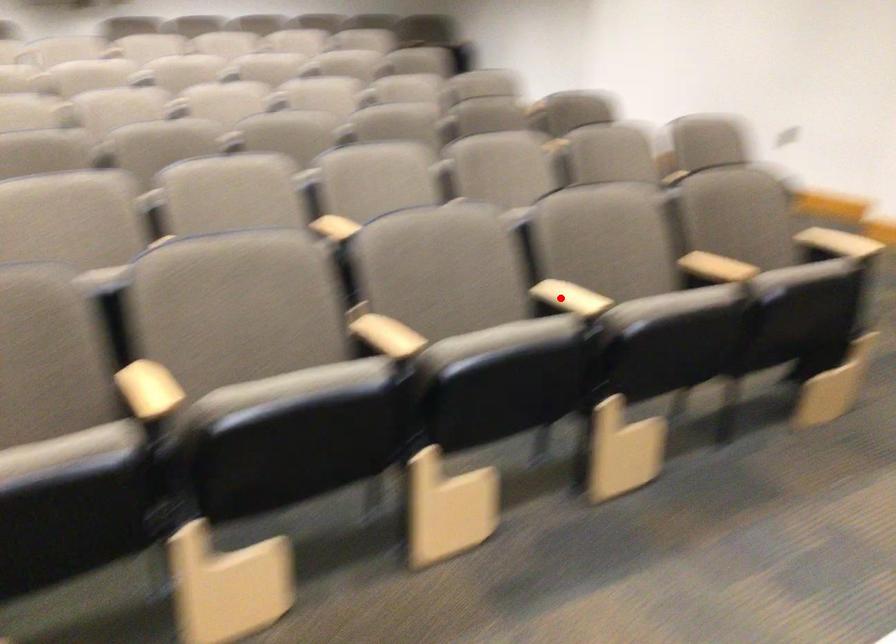
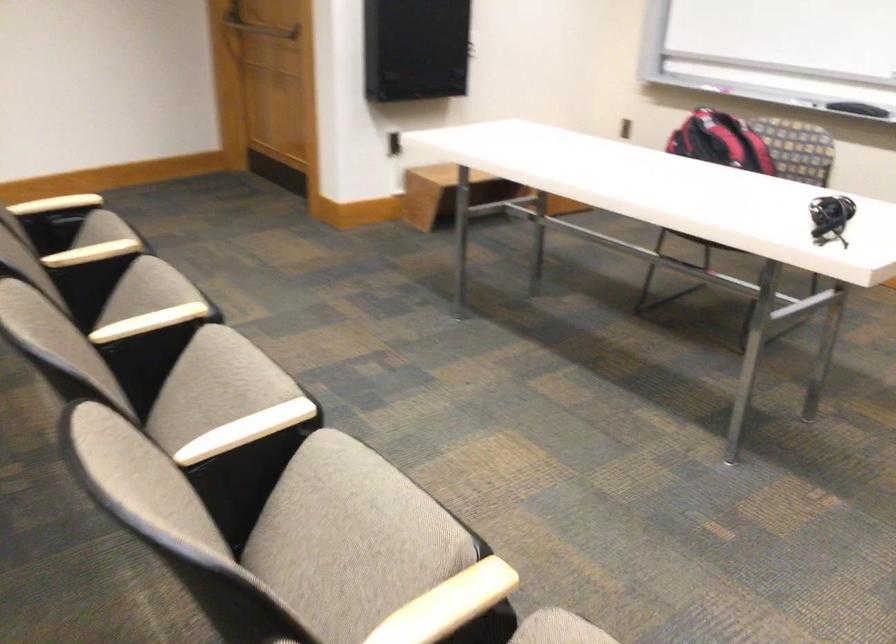
Question: I am providing you with two images of the same scene from different viewpoints. A red point is shown in image1. For the corresponding object point in image2, is it positioned nearer or farther from the camera?

Choices:
 (A) Nearer
 (B) Farther

Answer: (A)